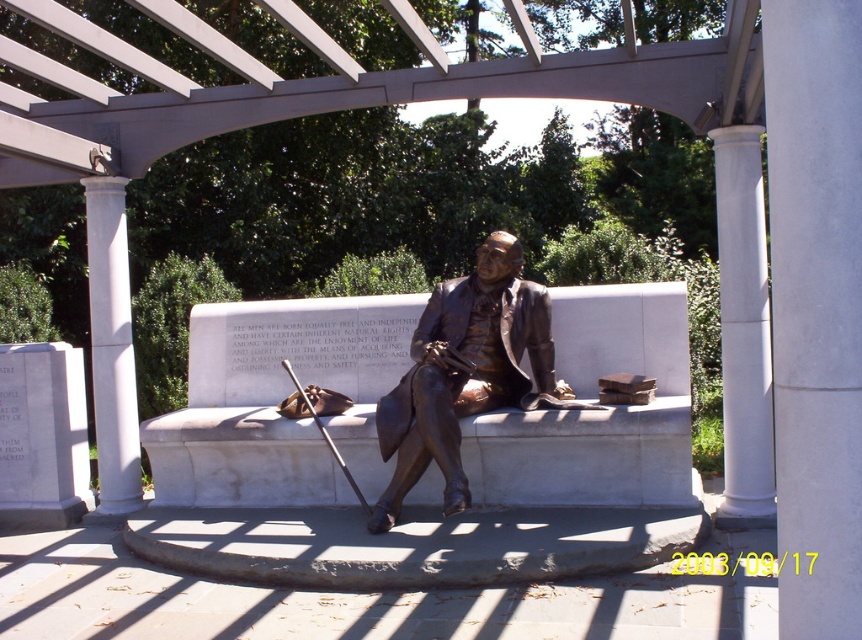
Question: Is bronze statue at center wider than white marble column at left?

Choices:
 (A) yes
 (B) no

Answer: (A)

Question: Can you confirm if bronze statue at center is positioned to the right of white marble column at left?

Choices:
 (A) yes
 (B) no

Answer: (A)

Question: Which object is the closest to the bronze statue at center?

Choices:
 (A) white marble column at right
 (B) white marble column at left

Answer: (A)

Question: Is bronze statue at center smaller than white marble column at left?

Choices:
 (A) yes
 (B) no

Answer: (B)

Question: Which of the following is the closest to the observer?

Choices:
 (A) (506, 308)
 (B) (95, 230)

Answer: (A)

Question: Which point appears closest to the camera in this image?

Choices:
 (A) (102, 260)
 (B) (759, 365)
 (C) (423, 442)

Answer: (C)